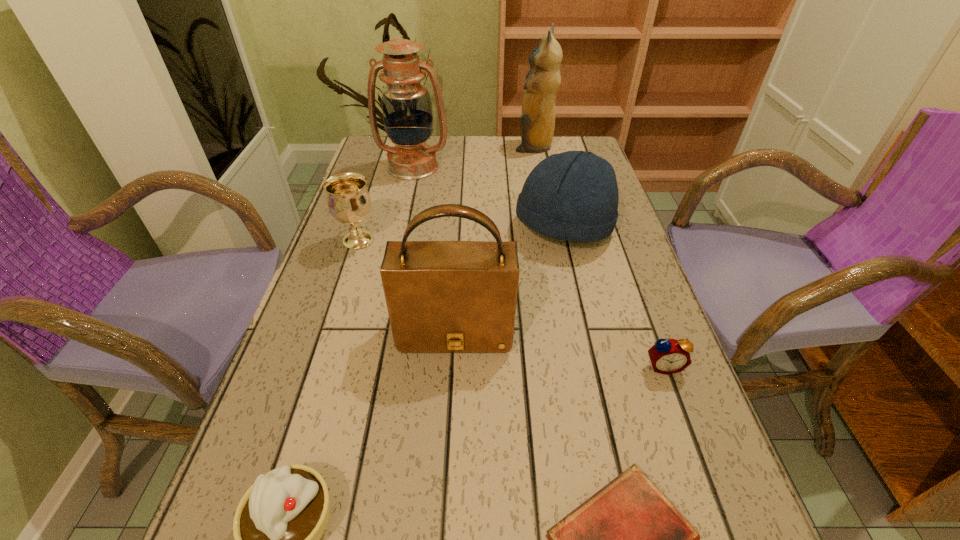
In order to click on skullcap present at the right edge in this screenshot , I will do pos(573,196).

The image size is (960, 540). In order to click on alarm clock at the right edge in this screenshot , I will do [x=667, y=356].

Identify the location of object that is at the far left corner. (407, 112).

At what (x,y) coordinates should I click in order to perform the action: click on object located at the far right corner. Please return your answer as a coordinate pair (x, y). The width and height of the screenshot is (960, 540). Looking at the image, I should click on (543, 80).

Where is `vacant area at the far edge of the desktop`? vacant area at the far edge of the desktop is located at coordinates (522, 163).

At what (x,y) coordinates should I click in order to perform the action: click on vacant space at the left edge of the desktop. Please return your answer as a coordinate pair (x, y). Looking at the image, I should click on (337, 392).

This screenshot has width=960, height=540. What are the coordinates of `vacant region at the right edge of the desktop` in the screenshot? It's located at (708, 485).

The image size is (960, 540). Find the location of `free space between the cat and the fifth farthest object`. free space between the cat and the fifth farthest object is located at coordinates (494, 239).

Where is `empty space that is in between the skullcap and the oil lamp`? empty space that is in between the skullcap and the oil lamp is located at coordinates (489, 197).

Locate an element on the screen. This screenshot has width=960, height=540. vacant area that lies between the oil lamp and the third nearest object is located at coordinates (539, 266).